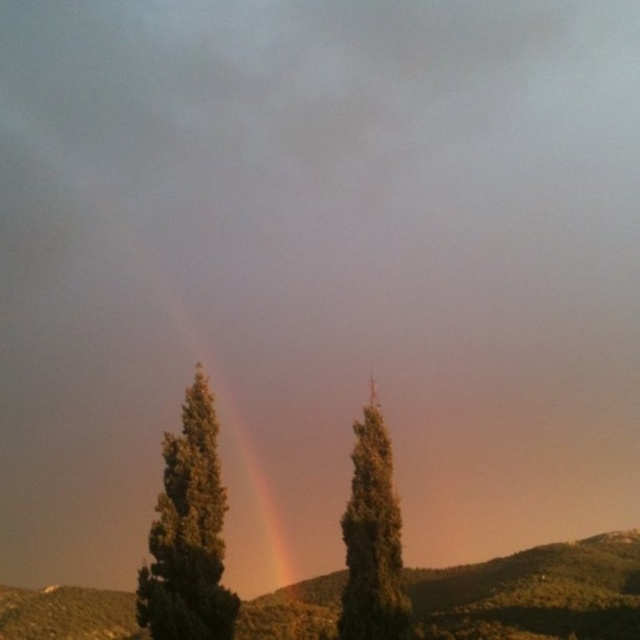
Can you confirm if green matte tree at center is positioned to the left of green textured tree at center?

Correct, you'll find green matte tree at center to the left of green textured tree at center.

Who is lower down, green matte tree at center or green textured tree at center?

green textured tree at center is below.

Does point (188, 529) lie behind point (355, 595)?

Yes.

The height and width of the screenshot is (640, 640). In order to click on green matte tree at center in this screenshot , I will do `click(188, 532)`.

Between green textured hill at lower center and rainbow at center, which one is positioned lower?

green textured hill at lower center is below.

Where is `green textured hill at lower center`? Image resolution: width=640 pixels, height=640 pixels. green textured hill at lower center is located at coordinates (536, 593).

This screenshot has height=640, width=640. Describe the element at coordinates (536, 593) in the screenshot. I see `green textured hill at lower center` at that location.

At what (x,y) coordinates should I click in order to perform the action: click on green textured hill at lower center. Please return your answer as a coordinate pair (x, y). The height and width of the screenshot is (640, 640). Looking at the image, I should click on (536, 593).

Measure the distance between green textured tree at center and rainbow at center.

22.23 meters

Who is more distant from viewer, (365, 515) or (259, 508)?

Point (259, 508)

Is point (376, 492) behind point (164, 307)?

No, it is not.

Locate an element on the screen. The image size is (640, 640). green textured tree at center is located at coordinates (372, 538).